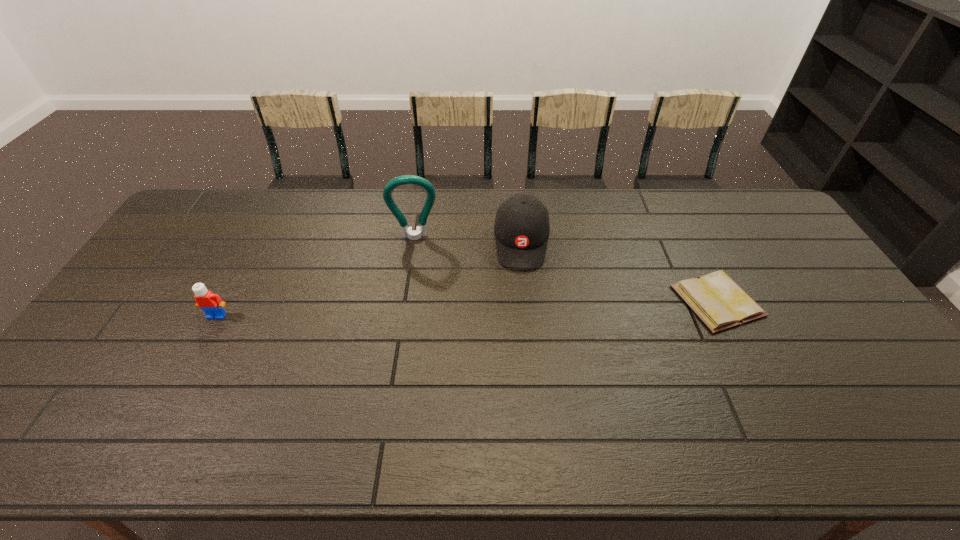
Find the location of a particular element. Lego is located at coordinates (211, 304).

Identify the location of diary. (718, 301).

This screenshot has height=540, width=960. In order to click on the rightmost object in this screenshot , I will do `click(718, 301)`.

The height and width of the screenshot is (540, 960). I want to click on bottle opener, so click(420, 231).

The image size is (960, 540). Identify the location of the third object from right to left. (420, 231).

The image size is (960, 540). In order to click on the third object from left to right in this screenshot , I will do `click(522, 227)`.

Find the location of `vacant space located on the face of the leftmost object`. vacant space located on the face of the leftmost object is located at coordinates (196, 356).

At what (x,y) coordinates should I click in order to perform the action: click on vacant space located on the left of the shortest object. Please return your answer as a coordinate pair (x, y). The image size is (960, 540). Looking at the image, I should click on (579, 301).

The height and width of the screenshot is (540, 960). I want to click on blank area located at the jaws of the third object from right to left, so point(418,314).

I want to click on vacant space located at the jaws of the third object from right to left, so click(417, 276).